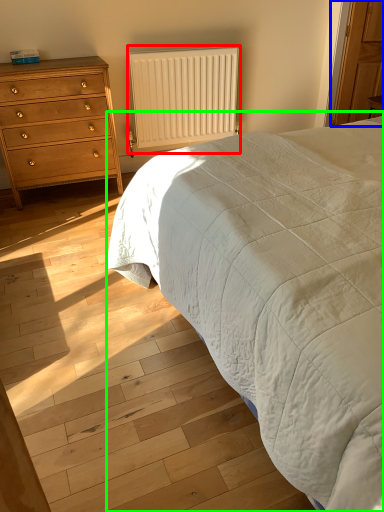
Question: Based on their relative distances, which object is farther from radiator (highlighted by a red box)? Choose from armoire (highlighted by a blue box) and bed (highlighted by a green box).

Choices:
 (A) armoire
 (B) bed

Answer: (B)